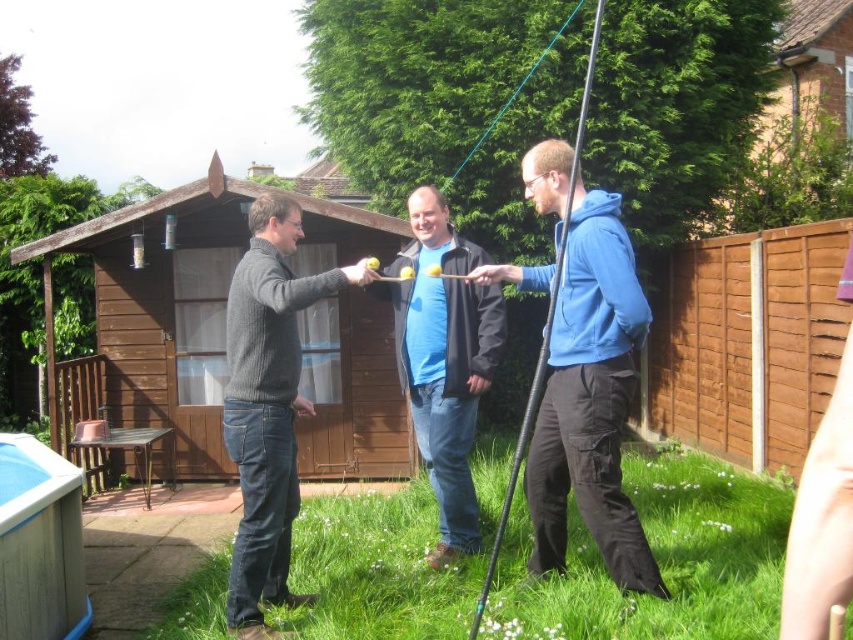
Where is `knitted gray sweater at center`? knitted gray sweater at center is located at coordinates (267, 404).

Where is `knitted gray sweater at center`? The image size is (853, 640). knitted gray sweater at center is located at coordinates (267, 404).

Which is in front, point (534, 284) or point (440, 368)?

Point (534, 284) is more forward.

What do you see at coordinates (590, 400) in the screenshot?
I see `blue matte hoodie at center` at bounding box center [590, 400].

You are a GUI agent. You are given a task and a screenshot of the screen. Output one action in this format:
    pyautogui.click(x=<x>, y=<y>)
    Task: Click on the blue matte hoodie at center
    The image size is (853, 640).
    Given the screenshot: What is the action you would take?
    pyautogui.click(x=590, y=400)

Does point (100, 246) come closer to viewer compared to point (254, 554)?

No, (100, 246) is behind (254, 554).

This screenshot has height=640, width=853. Find the location of `brown wooden hut at center`. brown wooden hut at center is located at coordinates (163, 308).